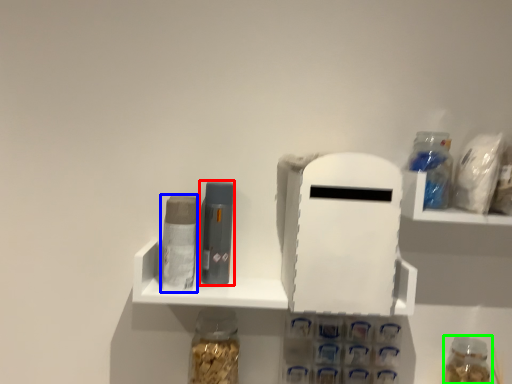
Question: Considering the real-world distances, which object is closest to toiletry (highlighted by a red box)? toiletry (highlighted by a blue box) or bottle (highlighted by a green box).

Choices:
 (A) toiletry
 (B) bottle

Answer: (A)